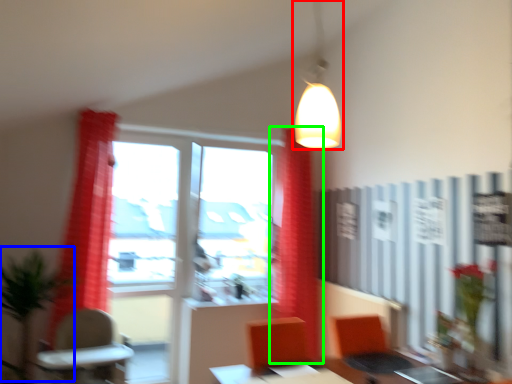
Question: Based on their relative distances, which object is nearer to lamp (highlighted by a red box)? Choose from plant (highlighted by a blue box) and curtain (highlighted by a green box).

Choices:
 (A) plant
 (B) curtain

Answer: (B)